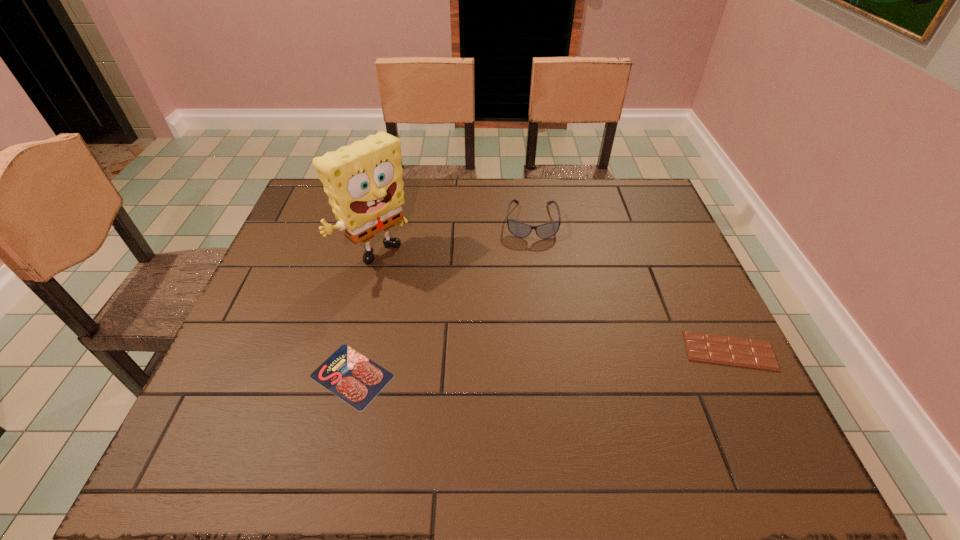
The image size is (960, 540). In the image, there is a desktop. In order to click on vacant space at the far left corner in this screenshot , I will do `click(320, 220)`.

The height and width of the screenshot is (540, 960). Find the location of `vacant region at the near left corner of the desktop`. vacant region at the near left corner of the desktop is located at coordinates (209, 395).

Locate an element on the screen. Image resolution: width=960 pixels, height=540 pixels. vacant space at the far right corner is located at coordinates (636, 200).

Locate an element on the screen. The width and height of the screenshot is (960, 540). free region at the near right corner of the desktop is located at coordinates (743, 389).

Locate an element on the screen. The width and height of the screenshot is (960, 540). free space that is in between the salami and the rightmost object is located at coordinates (540, 363).

Locate an element on the screen. empty location between the third object from left to right and the salami is located at coordinates (442, 299).

Where is `unoccupied position between the rightmost object and the tallest object`? The height and width of the screenshot is (540, 960). unoccupied position between the rightmost object and the tallest object is located at coordinates (553, 303).

Locate an element on the screen. This screenshot has width=960, height=540. blank region between the second object from right to left and the salami is located at coordinates (442, 299).

You are a GUI agent. You are given a task and a screenshot of the screen. Output one action in this format:
    pyautogui.click(x=<x>, y=<y>)
    Task: Click on the vacant space that is in between the salami and the third object from left to right
    Image resolution: width=960 pixels, height=540 pixels.
    Given the screenshot: What is the action you would take?
    pyautogui.click(x=442, y=299)

Identify the location of vacant point located between the sponge and the salami. The image size is (960, 540). (365, 316).